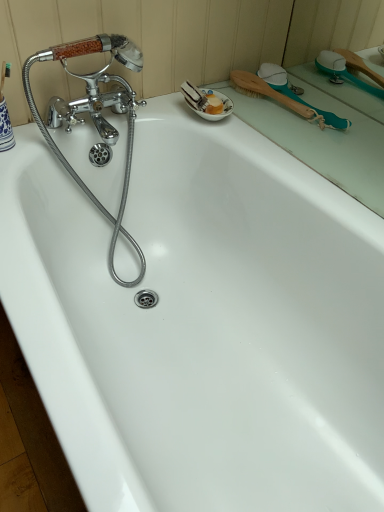
Question: From a real-world perspective, is teal plastic brush at upper right positioned under teal rubber shower brush at upper right based on gravity?

Choices:
 (A) no
 (B) yes

Answer: (B)

Question: Can you confirm if teal plastic brush at upper right is taller than teal rubber shower brush at upper right?

Choices:
 (A) no
 (B) yes

Answer: (A)

Question: Is teal plastic brush at upper right positioned before teal rubber shower brush at upper right?

Choices:
 (A) no
 (B) yes

Answer: (B)

Question: Is teal plastic brush at upper right not within teal rubber shower brush at upper right?

Choices:
 (A) no
 (B) yes

Answer: (B)

Question: Is teal plastic brush at upper right positioned behind teal rubber shower brush at upper right?

Choices:
 (A) yes
 (B) no

Answer: (B)

Question: Is teal plastic brush at upper right oriented away from teal rubber shower brush at upper right?

Choices:
 (A) no
 (B) yes

Answer: (A)

Question: Considering the relative sizes of teal rubber shower brush at upper right and teal plastic brush at upper right in the image provided, is teal rubber shower brush at upper right shorter than teal plastic brush at upper right?

Choices:
 (A) yes
 (B) no

Answer: (B)

Question: Can you confirm if teal rubber shower brush at upper right is taller than teal plastic brush at upper right?

Choices:
 (A) no
 (B) yes

Answer: (B)

Question: Is teal rubber shower brush at upper right further to the viewer compared to teal plastic brush at upper right?

Choices:
 (A) no
 (B) yes

Answer: (B)

Question: Is teal rubber shower brush at upper right not near teal plastic brush at upper right?

Choices:
 (A) yes
 (B) no

Answer: (B)

Question: From a real-world perspective, does teal rubber shower brush at upper right sit lower than teal plastic brush at upper right?

Choices:
 (A) no
 (B) yes

Answer: (A)

Question: Would you say teal rubber shower brush at upper right is outside teal plastic brush at upper right?

Choices:
 (A) no
 (B) yes

Answer: (B)

Question: Considering the relative positions of teal rubber shower brush at upper right and teal plastic brush at upper right in the image provided, is teal rubber shower brush at upper right to the left or to the right of teal plastic brush at upper right?

Choices:
 (A) left
 (B) right

Answer: (A)